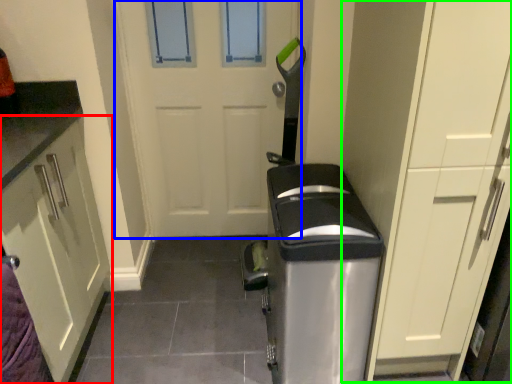
Question: Which object is positioned farthest from cabinetry (highlighted by a red box)? Select from door (highlighted by a blue box) and dresser (highlighted by a green box).

Choices:
 (A) door
 (B) dresser

Answer: (B)